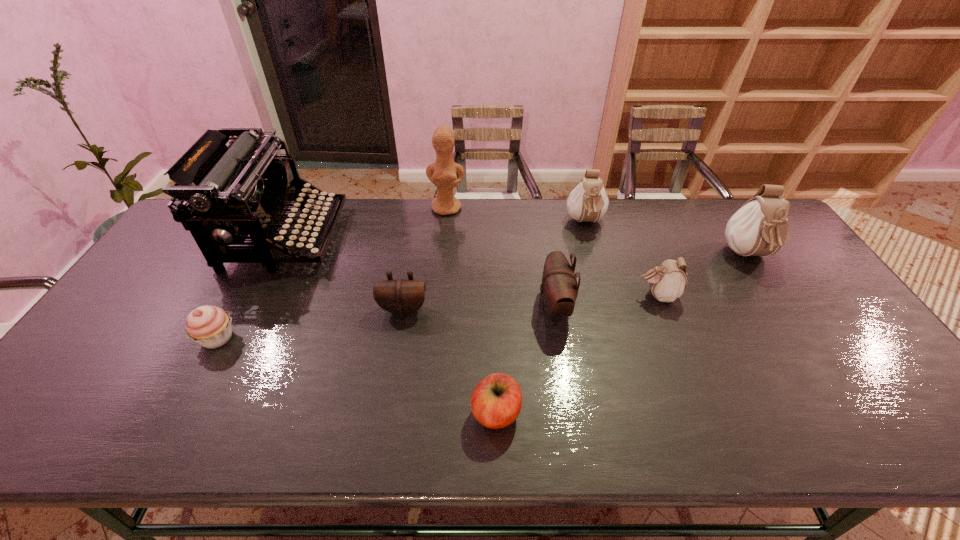
Identify which white pouch is located as the third nearest to the cupcake. Please provide its 2D coordinates. Your answer should be formatted as a tuple, i.e. [(x, y)], where the tuple contains the x and y coordinates of a point satisfying the conditions above.

[(759, 228)]

Where is `free space in the image that satisfies the following two spatial constraints: 1. on the front-facing side of the rightmost object; 2. on the front-facing side of the fourth pouch from left to right`? This screenshot has height=540, width=960. free space in the image that satisfies the following two spatial constraints: 1. on the front-facing side of the rightmost object; 2. on the front-facing side of the fourth pouch from left to right is located at coordinates (775, 295).

You are a GUI agent. You are given a task and a screenshot of the screen. Output one action in this format:
    pyautogui.click(x=<x>, y=<y>)
    Task: Click on the vacant space that satisfies the following two spatial constraints: 1. on the typing side of the fifth object from left to right; 2. on the right side of the typewriter
    
    Given the screenshot: What is the action you would take?
    pyautogui.click(x=194, y=413)

Find the location of a particular element. This screenshot has height=540, width=960. vacant area that satisfies the following two spatial constraints: 1. on the front-facing side of the seventh object from left to right; 2. on the typing side of the black typewriter is located at coordinates (589, 237).